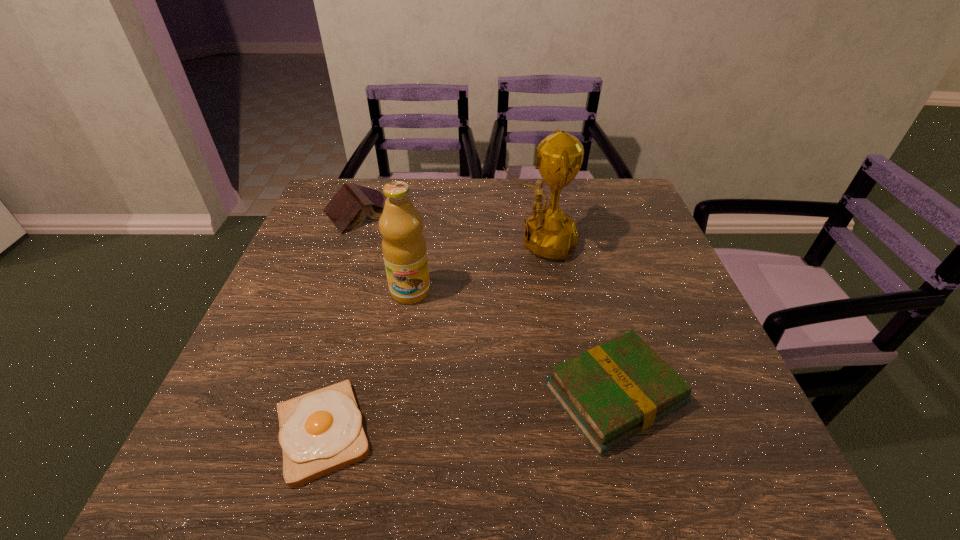
Where is `object that is at the near left corner`? This screenshot has width=960, height=540. object that is at the near left corner is located at coordinates (320, 432).

At what (x,y) coordinates should I click in order to perform the action: click on object present at the near right corner. Please return your answer as a coordinate pair (x, y). The width and height of the screenshot is (960, 540). Looking at the image, I should click on (611, 392).

In the image, there is a desktop. Where is `free space at the far edge`? free space at the far edge is located at coordinates [x=430, y=183].

The width and height of the screenshot is (960, 540). Identify the location of vacant region at the near edge of the desktop. (395, 483).

Find the location of a particular element. This screenshot has width=960, height=540. free location at the left edge is located at coordinates (220, 400).

The height and width of the screenshot is (540, 960). In the image, there is a desktop. What are the coordinates of `free space at the right edge` in the screenshot? It's located at (650, 243).

In the image, there is a desktop. Identify the location of vacant space at the far left corner. This screenshot has width=960, height=540. (327, 181).

I want to click on vacant space at the near left corner, so click(x=204, y=481).

Locate an element on the screen. Image resolution: width=960 pixels, height=540 pixels. vacant space at the far right corner is located at coordinates (646, 219).

Where is `free space at the near right corner`? The image size is (960, 540). free space at the near right corner is located at coordinates (753, 485).